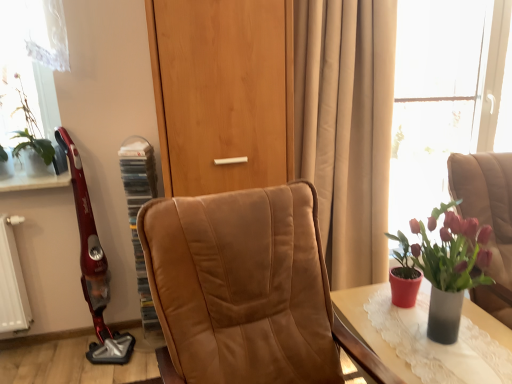
Question: Considering the relative positions of brown leather chair at right, acting as the second chair starting from the left, and leather chair at center, which is the first chair in left-to-right order, in the image provided, is brown leather chair at right, acting as the second chair starting from the left, to the left or to the right of leather chair at center, which is the first chair in left-to-right order,?

Choices:
 (A) right
 (B) left

Answer: (A)

Question: From a real-world perspective, is brown leather chair at right, which ranks as the first chair in right-to-left order, above or below leather chair at center, which is the first chair in left-to-right order?

Choices:
 (A) above
 (B) below

Answer: (B)

Question: Which of these objects is positioned closest to the brown leather chair at right, which ranks as the first chair in right-to-left order?

Choices:
 (A) beige fabric curtain at center
 (B) matte gray table at lower right
 (C) purple matte vase at right, which ranks as the 2th houseplant in left-to-right order
 (D) green leafy plant at upper left, the 2th houseplant ordered from the bottom
 (E) leather chair at center, marked as the 2th chair in a right-to-left arrangement

Answer: (C)

Question: Based on their relative distances, which object is nearer to the transparent glass window at upper right?

Choices:
 (A) brown leather chair at right, which ranks as the first chair in right-to-left order
 (B) metallic red vacuum cleaner at left
 (C) purple matte vase at right, positioned as the second houseplant in top-to-bottom order
 (D) beige fabric curtain at center
 (E) green leafy plant at upper left, which is counted as the first houseplant, starting from the top

Answer: (D)